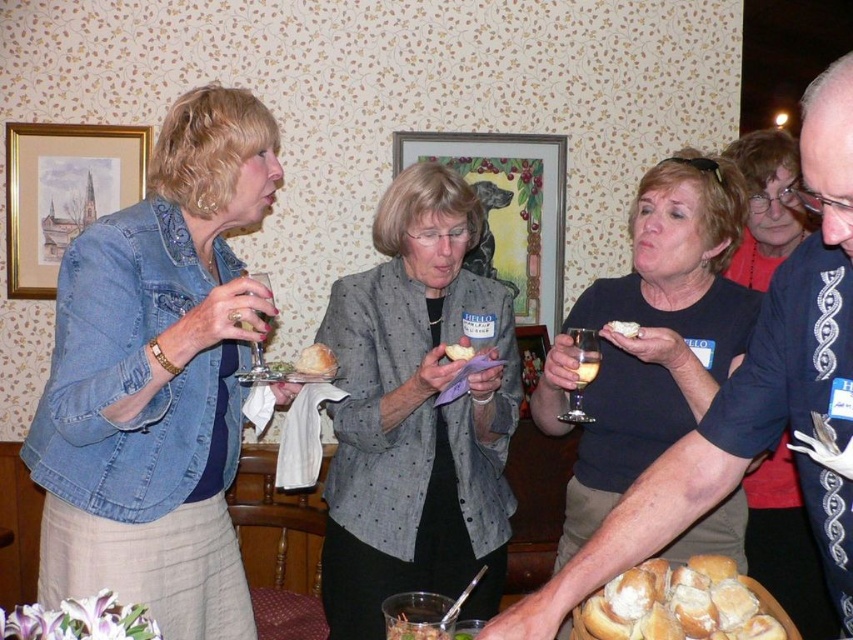
Question: Which point is closer to the camera?

Choices:
 (A) bread roll at center
 (B) translucent glass at upper center
 (C) dark blue embroidered shirt at center
 (D) translucent glass wine glass at center

Answer: (C)

Question: Does gray dotted blazer at center appear over matte black shirt at center?

Choices:
 (A) yes
 (B) no

Answer: (B)

Question: Among these points, which one is farthest from the camera?

Choices:
 (A) (577, 349)
 (B) (350, 621)
 (C) (297, 356)

Answer: (C)

Question: Considering the real-world distances, which object is farthest from the translucent glass at upper center?

Choices:
 (A) white bread at center
 (B) golden bread at center

Answer: (B)

Question: Observing the image, what is the correct spatial positioning of gray dotted blazer at center in reference to golden bread at center?

Choices:
 (A) below
 (B) above

Answer: (A)

Question: Can you confirm if gray dotted blazer at center is thinner than translucent glass at upper center?

Choices:
 (A) no
 (B) yes

Answer: (A)